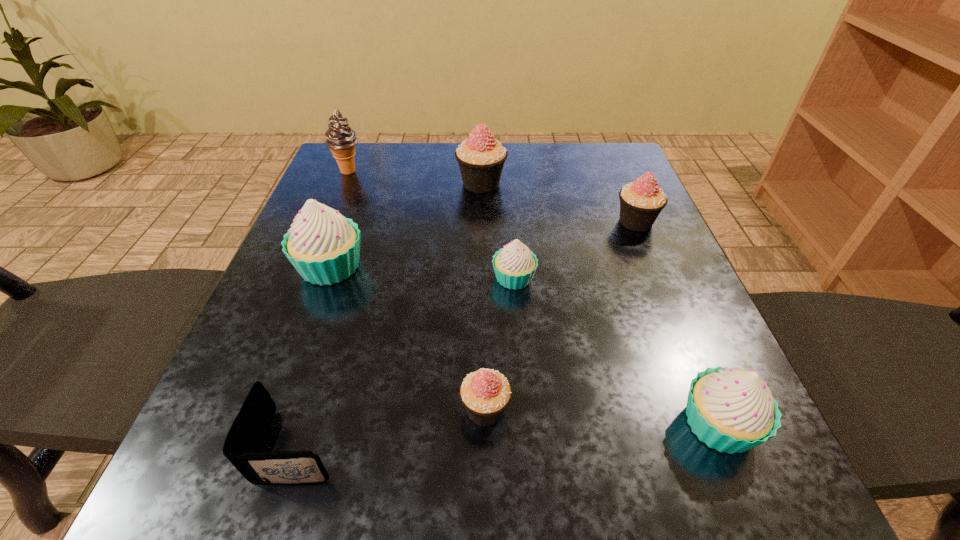
This screenshot has width=960, height=540. I want to click on the smallest pink cupcake, so click(485, 393).

This screenshot has width=960, height=540. In order to click on wallet in this screenshot , I will do [x=243, y=442].

Locate an element on the screen. This screenshot has height=540, width=960. free location located 0.150m on the front of the icecream is located at coordinates (330, 217).

This screenshot has width=960, height=540. I want to click on vacant region located 0.220m on the right of the farthest cupcake, so click(x=599, y=183).

Image resolution: width=960 pixels, height=540 pixels. Find the location of `vacant space located 0.340m on the back of the leftmost white cupcake`. vacant space located 0.340m on the back of the leftmost white cupcake is located at coordinates (370, 159).

Find the location of a particular element. The width and height of the screenshot is (960, 540). blank area located 0.390m on the left of the rightmost pink cupcake is located at coordinates tap(430, 221).

In order to click on free space located on the back of the nearest white cupcake in this screenshot , I will do `click(672, 313)`.

Locate an element on the screen. This screenshot has height=540, width=960. vacant area located on the left of the smallest white cupcake is located at coordinates (340, 278).

This screenshot has height=540, width=960. I want to click on free spot located on the back of the nearest pink cupcake, so click(x=484, y=223).

At what (x,y) coordinates should I click in order to perform the action: click on vacant region located on the outer surface of the wallet. Please return your answer as a coordinate pair (x, y). The image size is (960, 540). Looking at the image, I should click on (378, 445).